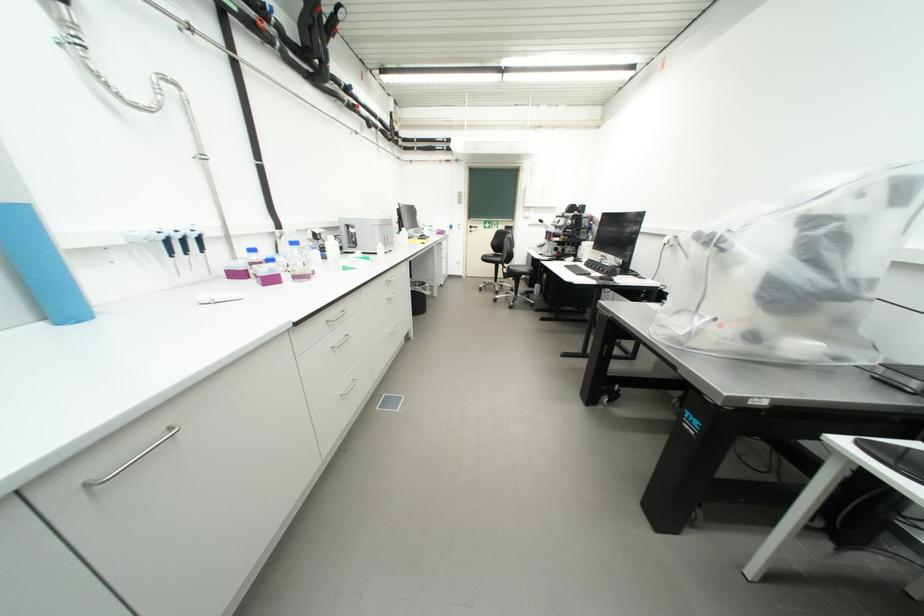
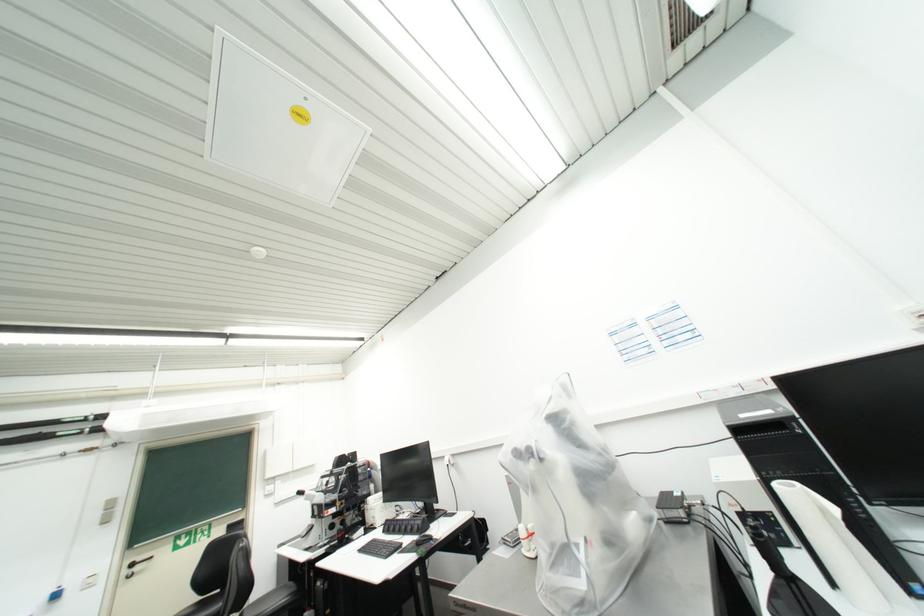
The first image is from the beginning of the video and the second image is from the end. How did the camera likely rotate when shooting the video?

The camera's rotation is toward right-up.